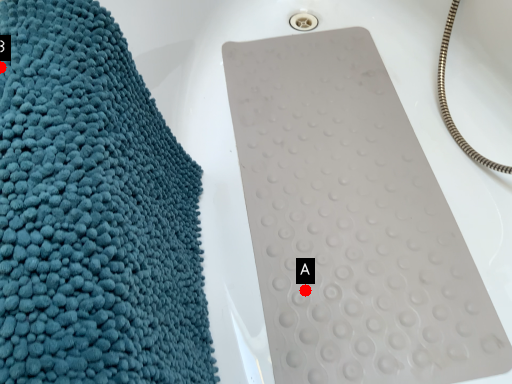
Question: Two points are circled on the image, labeled by A and B beside each circle. Among these points, which one is farthest from the camera?

Choices:
 (A) A is further
 (B) B is further

Answer: (A)